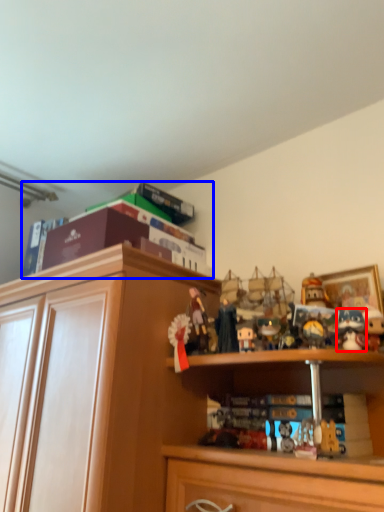
Question: Which of the following is the closest to the observer, toy (highlighted by a red box) or book (highlighted by a blue box)?

Choices:
 (A) toy
 (B) book

Answer: (A)